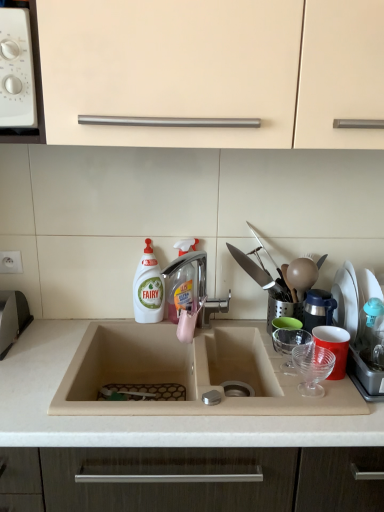
Question: In terms of width, does transparent plastic spray bottle at center look wider or thinner when compared to white plastic knobs at upper left?

Choices:
 (A) thin
 (B) wide

Answer: (A)

Question: Is transparent plastic spray bottle at center taller or shorter than white plastic knobs at upper left?

Choices:
 (A) short
 (B) tall

Answer: (B)

Question: Considering the real-world distances, which object is closest to the transparent plastic spray bottle at center?

Choices:
 (A) white plastic bottle at center
 (B) red plastic cup at right
 (C) white plastic knobs at upper left
 (D) beige laminate countertop at center
 (E) beige matte cabinet at upper center

Answer: (A)

Question: Based on their relative distances, which object is farther from the silver metallic tap at center?

Choices:
 (A) white plastic bottle at center
 (B) beige matte cabinet at upper center
 (C) red plastic cup at right
 (D) white plastic knobs at upper left
 (E) transparent plastic spray bottle at center

Answer: (D)